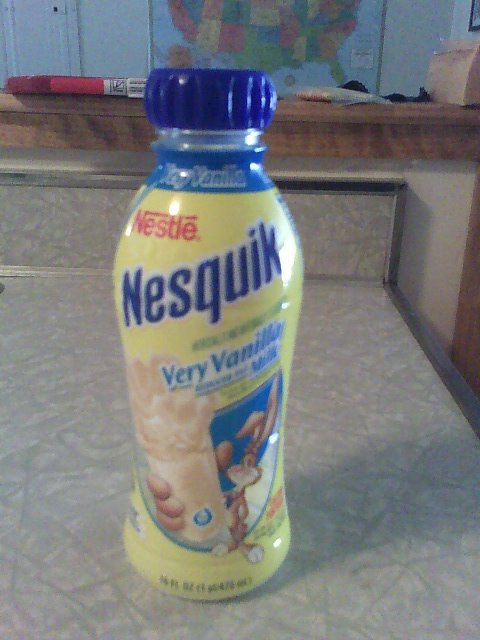
At what (x,y) coordinates should I click in order to perform the action: click on bottle. Please return your answer as a coordinate pair (x, y). Image resolution: width=480 pixels, height=640 pixels. Looking at the image, I should click on point(285,361).